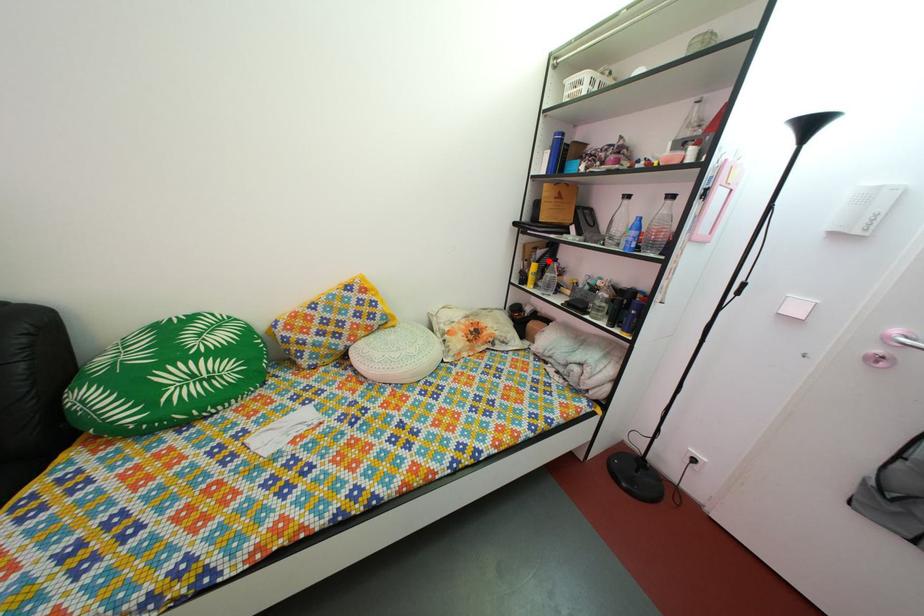
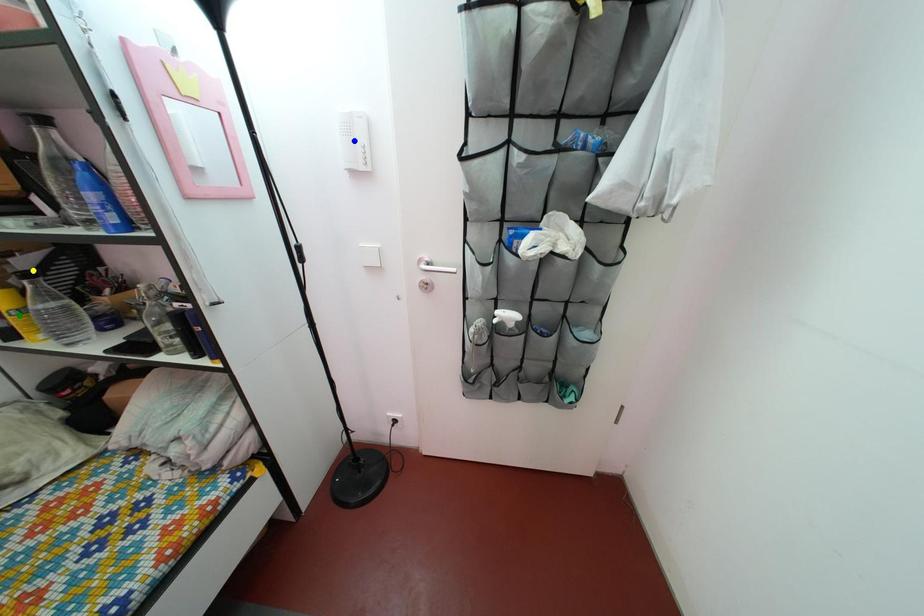
Question: I am providing you with two images of the same scene from different viewpoints. A red point is marked on the first image. You are given multiple points on the second image. Can you choose the point in image 2 that corresponds to the point in image 1?

Choices:
 (A) blue point
 (B) green point
 (C) yellow point

Answer: (C)